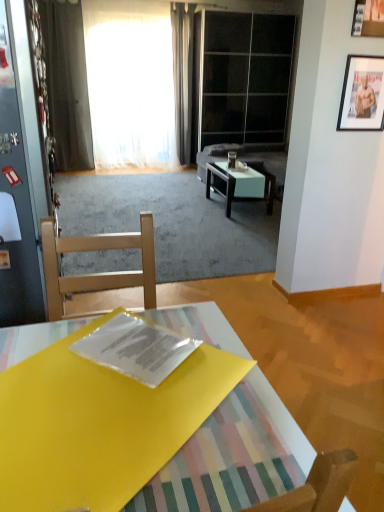
Question: Which direction should I rotate to face white glossy coffee table at center, the 2th coffee table in the bottom-to-top sequence, — up or down?

Choices:
 (A) up
 (B) down

Answer: (A)

Question: Is there a large distance between metallic glass door at left, which ranks as the first glass door in front-to-back order, and suede gray couch at center?

Choices:
 (A) yes
 (B) no

Answer: (A)

Question: Considering the relative sizes of metallic glass door at left, the second glass door viewed from the back, and suede gray couch at center in the image provided, is metallic glass door at left, the second glass door viewed from the back, taller than suede gray couch at center?

Choices:
 (A) yes
 (B) no

Answer: (A)

Question: Does metallic glass door at left, acting as the 2th glass door starting from the right, lie behind suede gray couch at center?

Choices:
 (A) no
 (B) yes

Answer: (A)

Question: Can you confirm if metallic glass door at left, marked as the 1th glass door in a bottom-to-top arrangement, is smaller than suede gray couch at center?

Choices:
 (A) yes
 (B) no

Answer: (A)

Question: Considering the relative sizes of metallic glass door at left, marked as the 1th glass door in a bottom-to-top arrangement, and suede gray couch at center in the image provided, is metallic glass door at left, marked as the 1th glass door in a bottom-to-top arrangement, bigger than suede gray couch at center?

Choices:
 (A) yes
 (B) no

Answer: (B)

Question: Is metallic glass door at left, which ranks as the first glass door in front-to-back order, in front of suede gray couch at center?

Choices:
 (A) no
 (B) yes

Answer: (B)

Question: Is yellow plastic folder at center, which appears as the second coffee table when viewed from the top, not within transparent plastic magazine at center?

Choices:
 (A) no
 (B) yes

Answer: (B)

Question: Is yellow plastic folder at center, the first coffee table in the bottom-to-top sequence, placed right next to transparent plastic magazine at center?

Choices:
 (A) no
 (B) yes

Answer: (A)

Question: Does yellow plastic folder at center, the first coffee table in the bottom-to-top sequence, have a lesser width compared to transparent plastic magazine at center?

Choices:
 (A) yes
 (B) no

Answer: (B)

Question: Is transparent plastic magazine at center surrounded by yellow plastic folder at center, which is counted as the 1th coffee table, starting from the front?

Choices:
 (A) yes
 (B) no

Answer: (B)

Question: Can you confirm if yellow plastic folder at center, the second coffee table positioned from the back, is wider than transparent plastic magazine at center?

Choices:
 (A) yes
 (B) no

Answer: (A)

Question: Is yellow plastic folder at center, the second coffee table positioned from the back, to the left of transparent plastic magazine at center from the viewer's perspective?

Choices:
 (A) no
 (B) yes

Answer: (B)

Question: Considering the relative positions of suede gray couch at center and transparent glass door at upper center, which is the first glass door in back-to-front order, in the image provided, is suede gray couch at center to the left of transparent glass door at upper center, which is the first glass door in back-to-front order, from the viewer's perspective?

Choices:
 (A) yes
 (B) no

Answer: (A)